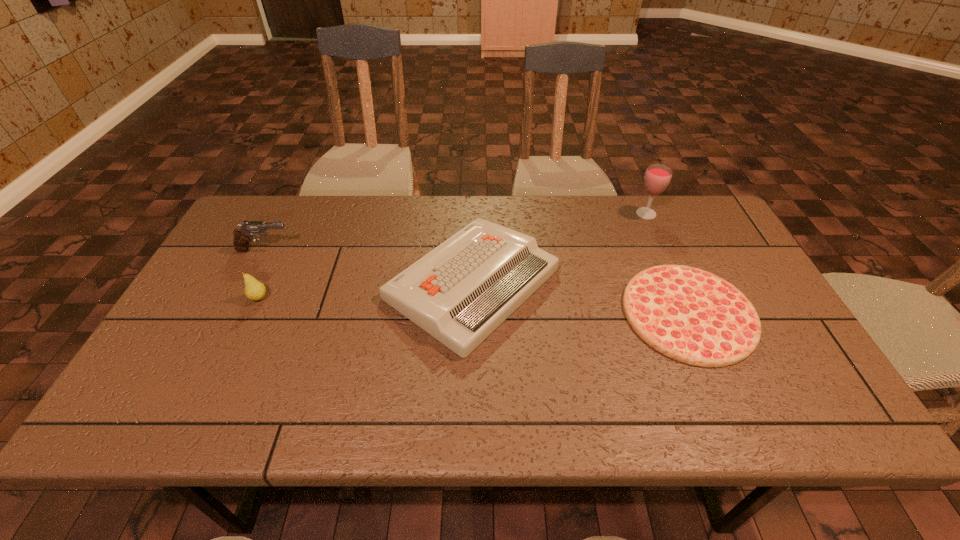
Select which object is the closest to the pistol. Please provide its 2D coordinates. Your answer should be formatted as a tuple, i.e. [(x, y)], where the tuple contains the x and y coordinates of a point satisfying the conditions above.

[(254, 290)]

The width and height of the screenshot is (960, 540). What are the coordinates of `object identified as the third closest to the pistol` in the screenshot? It's located at (693, 316).

Identify the location of vacant space that satisfies the following two spatial constraints: 1. on the back side of the shortest object; 2. on the right side of the farthest object. The height and width of the screenshot is (540, 960). (645, 214).

Locate an element on the screen. vacant region that satisfies the following two spatial constraints: 1. on the back side of the pear; 2. on the left side of the third object from right to left is located at coordinates (266, 284).

The width and height of the screenshot is (960, 540). Identify the location of free spot that satisfies the following two spatial constraints: 1. at the barrel of the pistol; 2. on the back side of the shortest object. (232, 313).

The width and height of the screenshot is (960, 540). I want to click on vacant space that satisfies the following two spatial constraints: 1. at the barrel of the pear; 2. on the left side of the pistol, so click(240, 298).

The height and width of the screenshot is (540, 960). What are the coordinates of `free space that satisfies the following two spatial constraints: 1. at the barrel of the pistol; 2. on the right side of the third object from left to right` in the screenshot? It's located at pyautogui.click(x=248, y=284).

Locate an element on the screen. vacant point that satisfies the following two spatial constraints: 1. on the front side of the second shortest object; 2. on the right side of the pizza is located at coordinates (471, 313).

The image size is (960, 540). I want to click on vacant space that satisfies the following two spatial constraints: 1. on the front side of the tallest object; 2. at the barrel of the pistol, so click(662, 250).